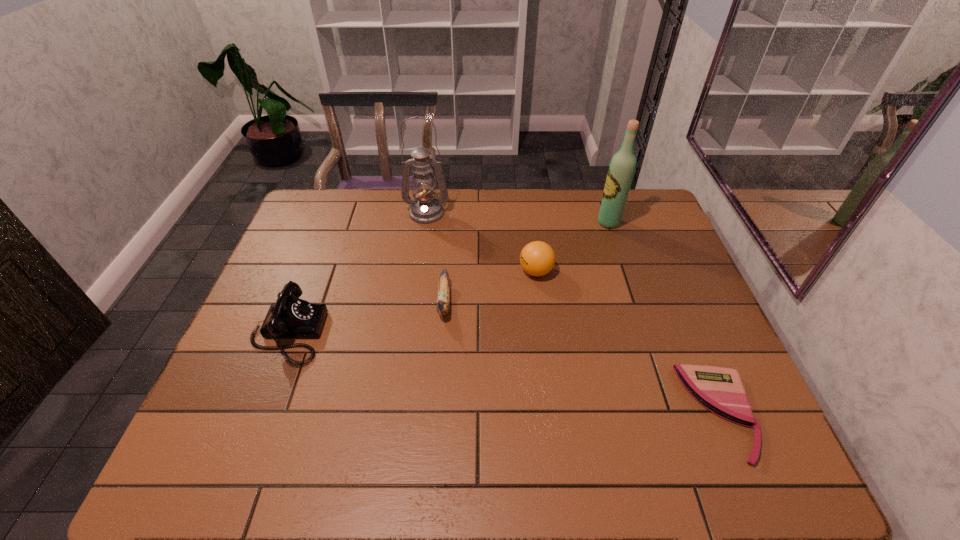
This screenshot has width=960, height=540. In order to click on wine bottle in this screenshot , I will do `click(621, 170)`.

Where is `oil lamp`? oil lamp is located at coordinates (425, 208).

Locate an element on the screen. The width and height of the screenshot is (960, 540). the leftmost object is located at coordinates (290, 317).

The height and width of the screenshot is (540, 960). Find the location of `the third object from right to left`. the third object from right to left is located at coordinates (537, 258).

Identify the location of banana. This screenshot has height=540, width=960. (443, 300).

Locate an element on the screen. The height and width of the screenshot is (540, 960). the shortest object is located at coordinates (720, 390).

Identify the location of vacant region located 0.270m on the front-facing side of the wine bottle. (517, 222).

This screenshot has height=540, width=960. I want to click on vacant point located 0.090m on the front-facing side of the wine bottle, so click(x=570, y=222).

This screenshot has width=960, height=540. Identify the location of vacant space located on the front-facing side of the wine bottle. (535, 222).

I want to click on blank space located on the left of the oil lamp, so click(x=318, y=213).